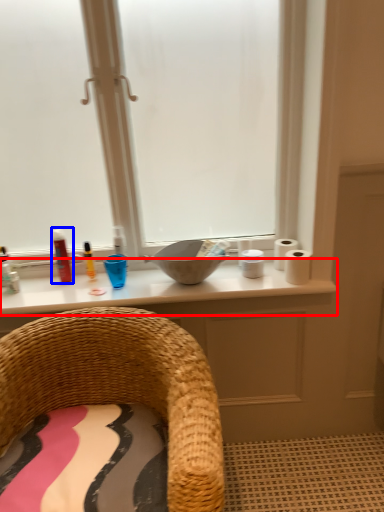
Question: Which object appears closest to the camera in this image, counter top (highlighted by a red box) or toiletry (highlighted by a blue box)?

Choices:
 (A) counter top
 (B) toiletry

Answer: (A)